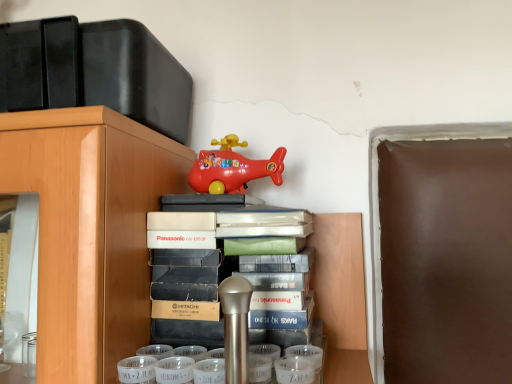
Question: From the image's perspective, is white matte book at center above or below matte plastic toy airplane at upper center?

Choices:
 (A) above
 (B) below

Answer: (B)

Question: In terms of width, does white matte book at center look wider or thinner when compared to matte plastic toy airplane at upper center?

Choices:
 (A) thin
 (B) wide

Answer: (B)

Question: In terms of size, does white matte book at center appear bigger or smaller than matte plastic toy airplane at upper center?

Choices:
 (A) small
 (B) big

Answer: (B)

Question: Based on their sizes in the image, would you say matte plastic toy airplane at upper center is bigger or smaller than white matte book at center?

Choices:
 (A) small
 (B) big

Answer: (A)

Question: Based on their positions, is matte plastic toy airplane at upper center located to the left or right of white matte book at center?

Choices:
 (A) right
 (B) left

Answer: (B)

Question: From their relative heights in the image, would you say matte plastic toy airplane at upper center is taller or shorter than white matte book at center?

Choices:
 (A) tall
 (B) short

Answer: (B)

Question: From a real-world perspective, relative to white matte book at center, is matte plastic toy airplane at upper center vertically above or below?

Choices:
 (A) below
 (B) above

Answer: (B)